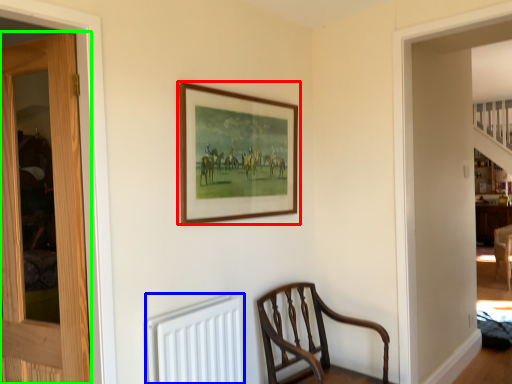
Question: Based on their relative distances, which object is farther from picture frame (highlighted by a red box)? Choose from radiator (highlighted by a blue box) and door (highlighted by a green box).

Choices:
 (A) radiator
 (B) door

Answer: (B)